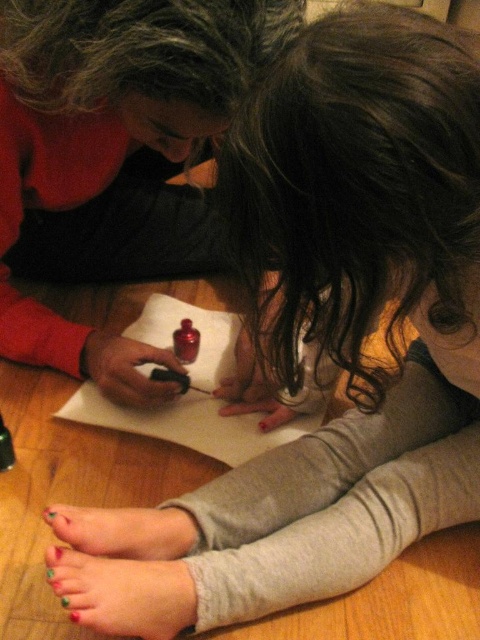
Question: Is multicolored painted toenails at lower left thinner than matte black crayon at center?

Choices:
 (A) yes
 (B) no

Answer: (B)

Question: Estimate the real-world distances between objects in this image. Which object is closer to the dark curly hair at center?

Choices:
 (A) matte black nail polish at center
 (B) multicolored painted toenails at lower center
 (C) matte black crayon at center

Answer: (A)

Question: Is matte black nail polish at center to the right of multicolored painted toenails at lower left from the viewer's perspective?

Choices:
 (A) no
 (B) yes

Answer: (A)

Question: Can you confirm if matte black nail polish at center is positioned below dark brown curly hair at upper center?

Choices:
 (A) yes
 (B) no

Answer: (A)

Question: Estimate the real-world distances between objects in this image. Which object is closer to the multicolored painted toenails at lower left?

Choices:
 (A) dark curly hair at center
 (B) multicolored painted toenails at lower center
 (C) matte black nail polish at center
 (D) white paper at center

Answer: (B)

Question: Which of the following is the closest to the observer?

Choices:
 (A) 168,372
 (B) 168,534
 (C) 190,13
 (D) 233,454

Answer: (C)